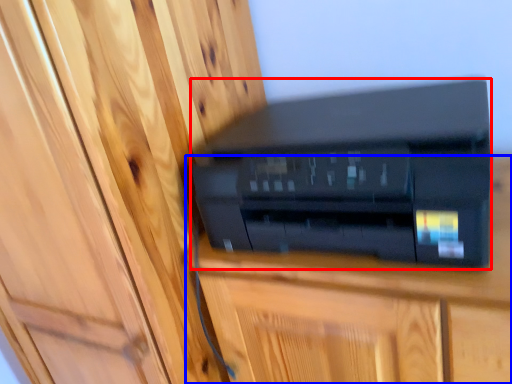
Question: Which point is further to the camera, printer (highlighted by a red box) or furniture (highlighted by a blue box)?

Choices:
 (A) printer
 (B) furniture

Answer: (B)